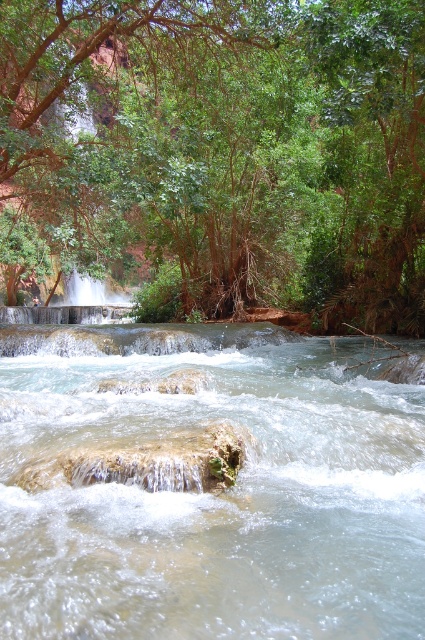
Question: Considering the real-world distances, which object is closest to the green leafy tree at upper center?

Choices:
 (A) green leafy tree at upper right
 (B) clear water stream at center

Answer: (A)

Question: In this image, where is green leafy tree at upper center located relative to green leafy tree at upper right?

Choices:
 (A) right
 (B) left

Answer: (B)

Question: Is clear water stream at center thinner than green leafy tree at upper right?

Choices:
 (A) yes
 (B) no

Answer: (B)

Question: Estimate the real-world distances between objects in this image. Which object is farther from the green leafy tree at upper center?

Choices:
 (A) clear water stream at center
 (B) green leafy tree at upper right

Answer: (A)

Question: Can you confirm if clear water stream at center is positioned to the left of green leafy tree at upper right?

Choices:
 (A) yes
 (B) no

Answer: (A)

Question: Which point is farther from the camera taking this photo?

Choices:
 (A) (401, 163)
 (B) (25, 371)
 (C) (396, 320)

Answer: (C)